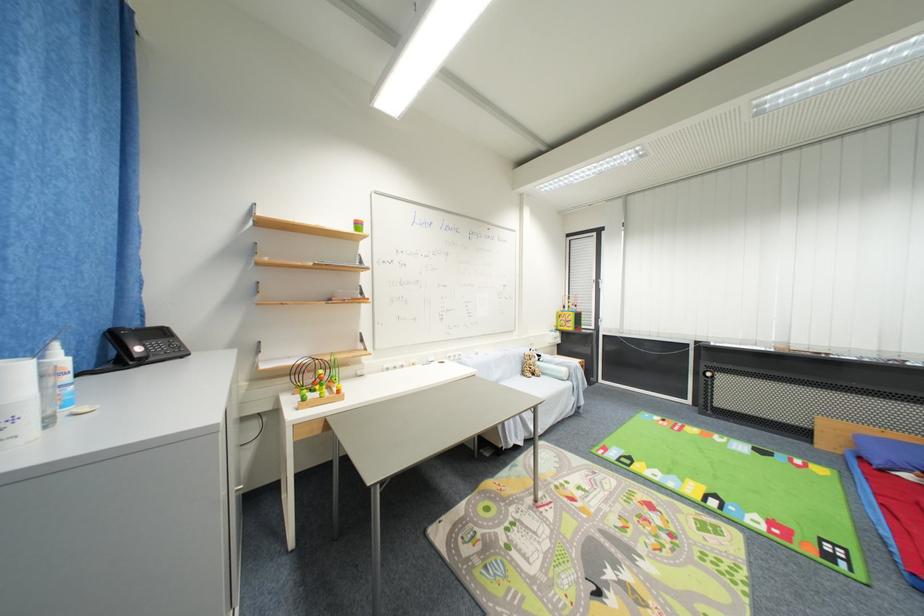
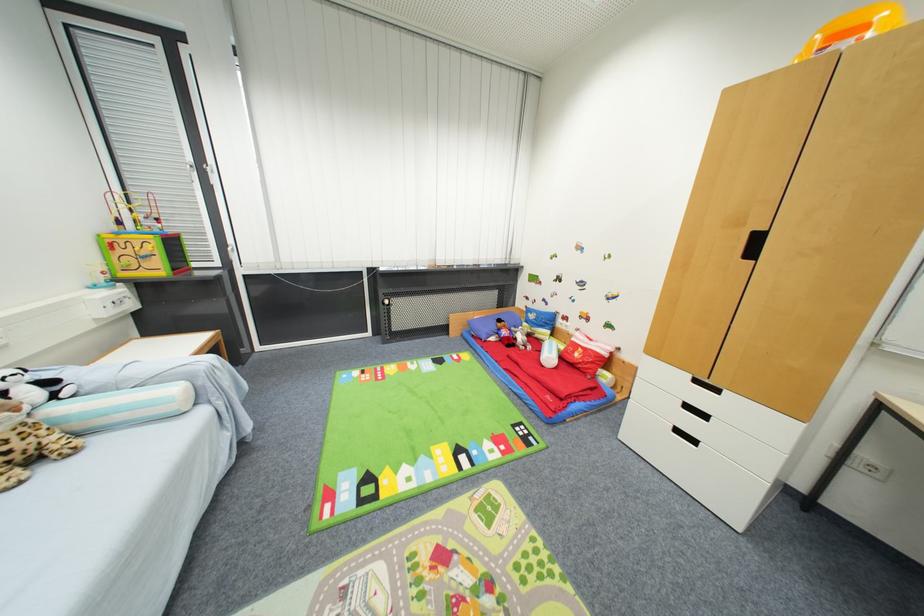
In the second image, find the point that corresponds to point (865, 440) in the first image.

(475, 325)